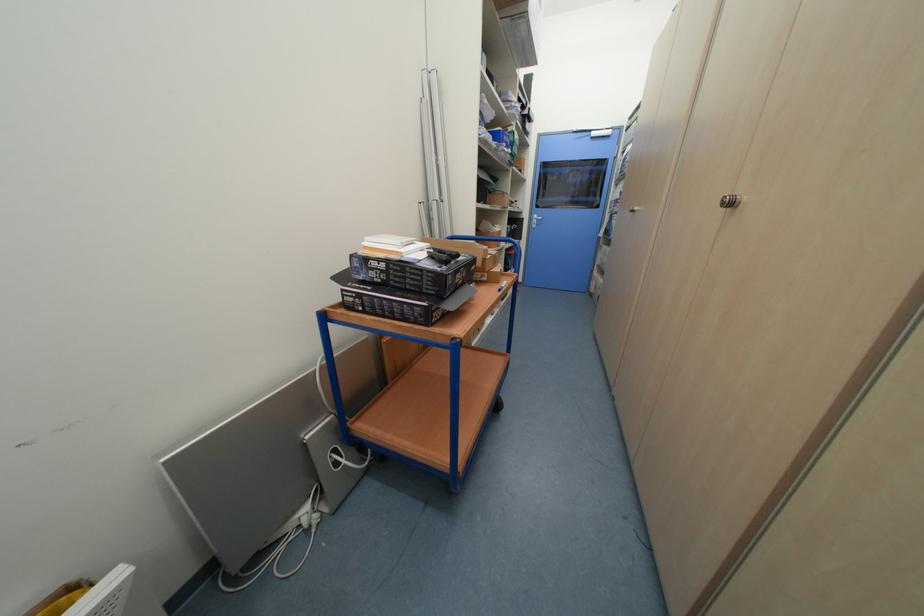
Identify the location of silver door handle. (728, 201).